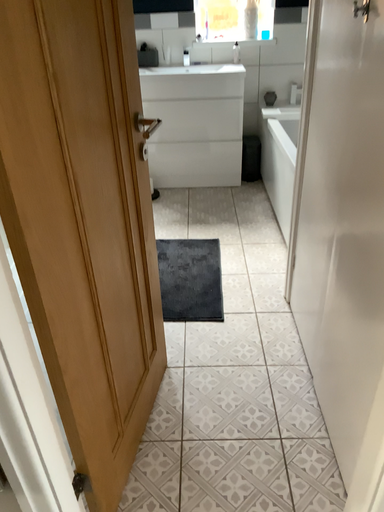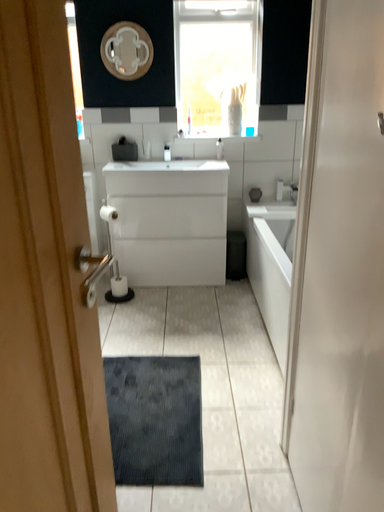
Question: Which way did the camera rotate in the video?

Choices:
 (A) rotated upward
 (B) rotated downward

Answer: (A)